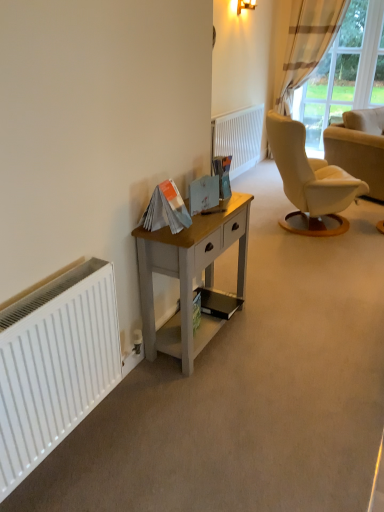
Question: Considering their positions, is light gray wood desk at center located in front of or behind white matte radiator at left, the 2th radiator viewed from the back?

Choices:
 (A) behind
 (B) front

Answer: (A)

Question: Considering the positions of light gray wood desk at center and white matte radiator at left, the first radiator when ordered from left to right, in the image, is light gray wood desk at center taller or shorter than white matte radiator at left, the first radiator when ordered from left to right,?

Choices:
 (A) tall
 (B) short

Answer: (A)

Question: Based on their relative distances, which object is farther from the white textured radiator at center, positioned as the 2th radiator in front-to-back order?

Choices:
 (A) plaid fabric curtain at upper right
 (B) light gray wood desk at center
 (C) brown striped fabric curtain at upper right
 (D) white matte radiator at left, the 2th radiator in the top-to-bottom sequence
 (E) matte gold wall sconce at upper center

Answer: (D)

Question: Which of these objects is positioned farthest from the white fabric chair at right?

Choices:
 (A) white matte radiator at left, the 2th radiator viewed from the back
 (B) matte gold wall sconce at upper center
 (C) brown striped fabric curtain at upper right
 (D) plaid fabric curtain at upper right
 (E) light gray wood desk at center

Answer: (A)